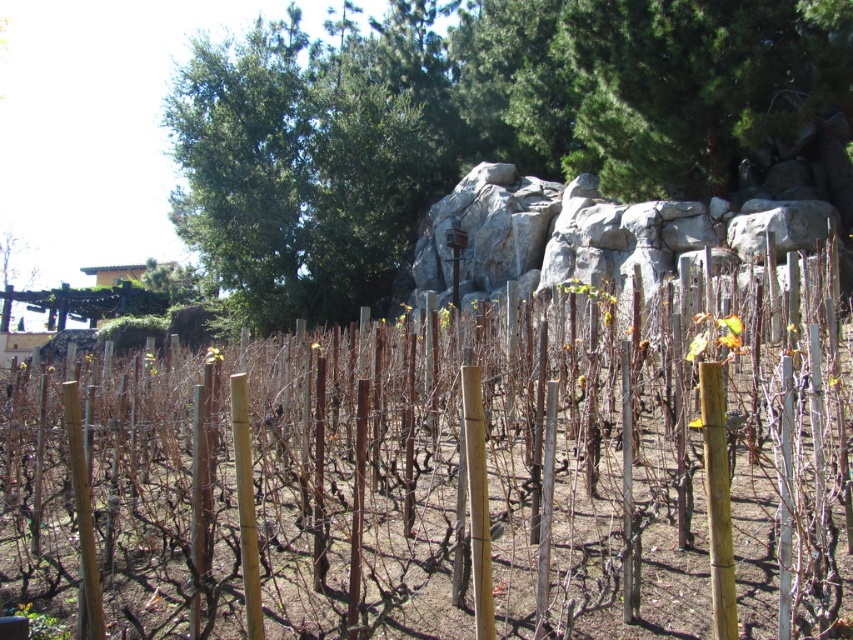
Is point (717, 305) positioned in front of point (815, 90)?

Yes.

Which is more to the left, brown wooden post at center or green leafy tree at upper center?

From the viewer's perspective, brown wooden post at center appears more on the left side.

Looking at this image, who is more forward, (505, 630) or (339, 154)?

Point (505, 630) is more forward.

Locate an element on the screen. The image size is (853, 640). brown wooden post at center is located at coordinates (440, 472).

Is brown wooden post at center below gray rock at center?

Result: Correct, brown wooden post at center is located below gray rock at center.

The height and width of the screenshot is (640, 853). Describe the element at coordinates (440, 472) in the screenshot. I see `brown wooden post at center` at that location.

The image size is (853, 640). Find the location of `brown wooden post at center`. brown wooden post at center is located at coordinates (440, 472).

Is green leafy tree at upper center to the left of gray rock at center from the viewer's perspective?

Correct, you'll find green leafy tree at upper center to the left of gray rock at center.

Who is positioned more to the right, green leafy tree at upper center or gray rock at center?

Positioned to the right is gray rock at center.

Does point (296, 58) come closer to viewer compared to point (502, 266)?

No, (296, 58) is further to viewer.

What are the coordinates of `green leafy tree at upper center` in the screenshot? It's located at (479, 124).